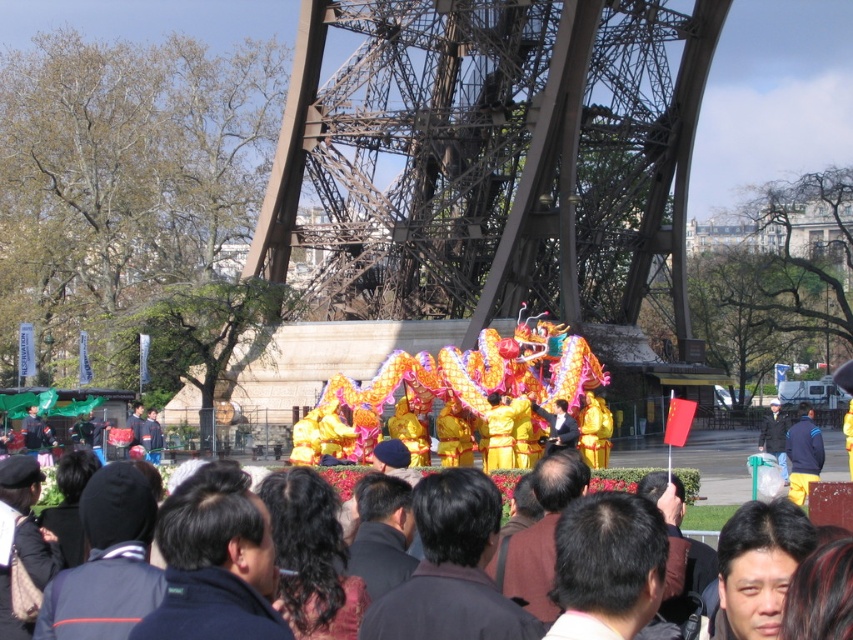
Can you confirm if metallic brown eiffel tower at center is shorter than yellow satin dragon at center?

In fact, metallic brown eiffel tower at center may be taller than yellow satin dragon at center.

What do you see at coordinates (492, 157) in the screenshot? The width and height of the screenshot is (853, 640). I see `metallic brown eiffel tower at center` at bounding box center [492, 157].

Between point (376, 268) and point (531, 333), which one is positioned in front?

Point (531, 333) is more forward.

Find the location of a particular element. The width and height of the screenshot is (853, 640). metallic brown eiffel tower at center is located at coordinates (492, 157).